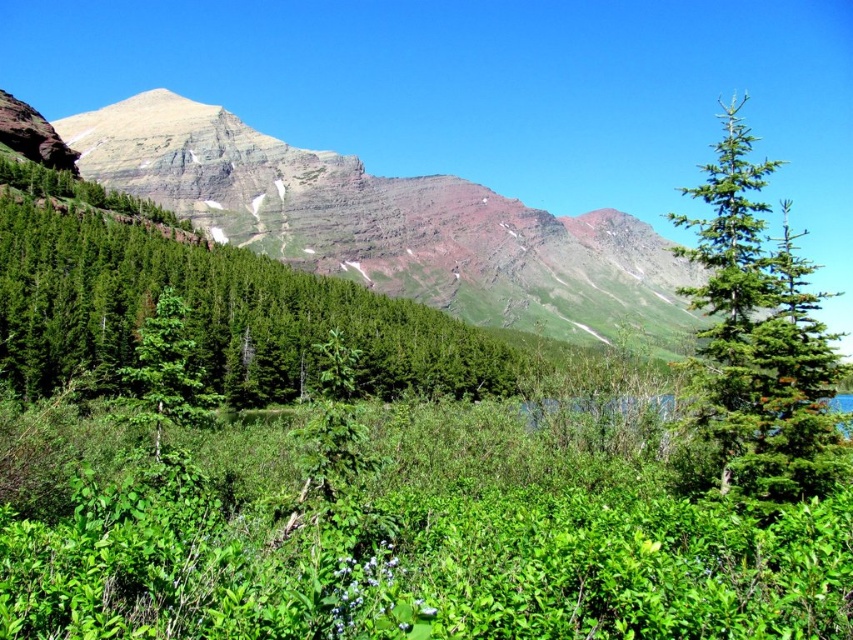
Question: Based on their relative distances, which object is nearer to the green matte tree at center?

Choices:
 (A) green matte tree at center-left
 (B) green needle-like at right
 (C) green grassy mountain at upper center

Answer: (A)

Question: Which point is closer to the camera taking this photo?

Choices:
 (A) (21, 362)
 (B) (525, 273)

Answer: (A)

Question: Does green matte tree at center appear on the right side of green needle-like at right?

Choices:
 (A) no
 (B) yes

Answer: (A)

Question: Does green grassy mountain at upper center appear over green needle-like at right?

Choices:
 (A) no
 (B) yes

Answer: (A)

Question: Considering the real-world distances, which object is closest to the green needle-like at right?

Choices:
 (A) green matte tree at center-left
 (B) green grassy mountain at upper center
 (C) green matte tree at center

Answer: (A)

Question: Does green grassy mountain at upper center have a lesser width compared to green matte tree at center-left?

Choices:
 (A) no
 (B) yes

Answer: (A)